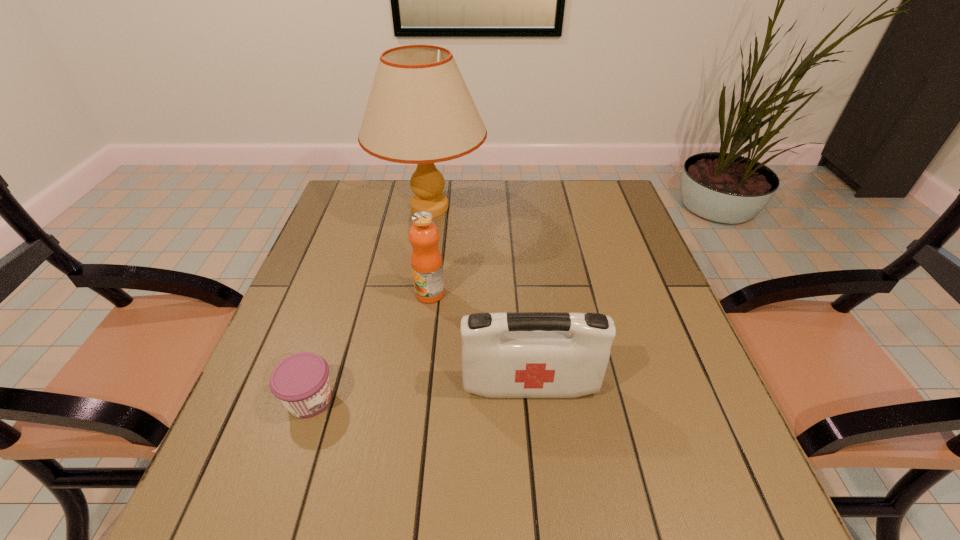
Where is `lampshade present at the left edge`? The image size is (960, 540). lampshade present at the left edge is located at coordinates (420, 111).

Where is `jam that is at the left edge`? jam that is at the left edge is located at coordinates (301, 382).

This screenshot has width=960, height=540. I want to click on object that is at the far left corner, so click(x=420, y=111).

Image resolution: width=960 pixels, height=540 pixels. In the image, there is a desktop. In order to click on free region at the far edge in this screenshot , I will do `click(399, 187)`.

At what (x,y) coordinates should I click in order to perform the action: click on free space at the left edge. Please return your answer as a coordinate pair (x, y). Looking at the image, I should click on (266, 460).

Where is `blank space at the right edge`? blank space at the right edge is located at coordinates (728, 436).

Where is `free space at the far left corner of the desktop`? This screenshot has width=960, height=540. free space at the far left corner of the desktop is located at coordinates (343, 181).

What are the coordinates of `vacant space at the far right corner` in the screenshot? It's located at (582, 198).

The height and width of the screenshot is (540, 960). What are the coordinates of `free space that is in between the farthest object and the first-aid kit` in the screenshot? It's located at (480, 297).

The image size is (960, 540). Identify the location of free space between the first-aid kit and the jam. (420, 393).